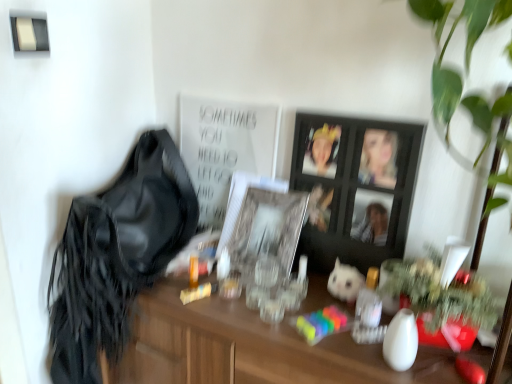
Locate an element on the screen. clear glass picture frame at center, which is counted as the first picture frame, starting from the left is located at coordinates (264, 228).

The height and width of the screenshot is (384, 512). What do you see at coordinates (225, 149) in the screenshot?
I see `white matte poster at upper center` at bounding box center [225, 149].

Where is `white matte poster at upper center`? white matte poster at upper center is located at coordinates (225, 149).

Locate an element on the screen. The width and height of the screenshot is (512, 384). white plush toy at center is located at coordinates (345, 282).

From the image's perspective, which one is positioned higher, black wooden picture frame at center, acting as the 1th picture frame starting from the right, or white plush toy at center?

black wooden picture frame at center, acting as the 1th picture frame starting from the right.

Is white plush toy at center located within black wooden picture frame at center, acting as the 1th picture frame starting from the right?

No, white plush toy at center is not inside black wooden picture frame at center, acting as the 1th picture frame starting from the right.

Is black wooden picture frame at center, arranged as the second picture frame when viewed from the left, aimed at white plush toy at center?

Yes, black wooden picture frame at center, arranged as the second picture frame when viewed from the left, is facing white plush toy at center.

Which object is positioned more to the left, black wooden picture frame at center, acting as the 1th picture frame starting from the right, or white plush toy at center?

black wooden picture frame at center, acting as the 1th picture frame starting from the right.

Does satin black shoulder bag at left have a lesser width compared to white plush toy at center?

In fact, satin black shoulder bag at left might be wider than white plush toy at center.

From the image's perspective, is satin black shoulder bag at left below white plush toy at center?

No, from the image's perspective, satin black shoulder bag at left is not beneath white plush toy at center.

Would you say satin black shoulder bag at left contains white plush toy at center?

No, satin black shoulder bag at left does not contain white plush toy at center.

Is satin black shoulder bag at left further to the viewer compared to white plush toy at center?

No.

From the image's perspective, between white plush toy at center and black wooden picture frame at center, arranged as the second picture frame when viewed from the left, who is located below?

white plush toy at center.

Which is behind, white plush toy at center or black wooden picture frame at center, arranged as the second picture frame when viewed from the left?

Positioned behind is white plush toy at center.

Locate an element on the screen. animal below the black wooden picture frame at center, acting as the 1th picture frame starting from the right (from a real-world perspective) is located at coordinates (345, 282).

How different are the orientations of white plush toy at center and black wooden picture frame at center, acting as the 1th picture frame starting from the right, in degrees?

The facing directions of white plush toy at center and black wooden picture frame at center, acting as the 1th picture frame starting from the right, are 1.4 degrees apart.

Can you confirm if white matte poster at upper center is positioned to the right of black wooden picture frame at center, arranged as the second picture frame when viewed from the left?

No, white matte poster at upper center is not to the right of black wooden picture frame at center, arranged as the second picture frame when viewed from the left.

From a real-world perspective, is white matte poster at upper center physically located above or below black wooden picture frame at center, acting as the 1th picture frame starting from the right?

Clearly, from a real-world perspective, white matte poster at upper center is above black wooden picture frame at center, acting as the 1th picture frame starting from the right.

Image resolution: width=512 pixels, height=384 pixels. In order to click on picture frame that is the 1st object located below the white matte poster at upper center (from the image's perspective) in this screenshot , I will do `click(355, 187)`.

Is point (206, 118) closer to viewer compared to point (332, 116)?

That is False.

Is satin black shoulder bag at left surrounding white matte poster at upper center?

No.

Is satin black shoulder bag at left wider or thinner than white matte poster at upper center?

satin black shoulder bag at left is wider than white matte poster at upper center.

Considering the positions of objects satin black shoulder bag at left and white matte poster at upper center in the image provided, who is more to the left, satin black shoulder bag at left or white matte poster at upper center?

Positioned to the left is satin black shoulder bag at left.

Considering the relative sizes of satin black shoulder bag at left and white matte poster at upper center in the image provided, is satin black shoulder bag at left smaller than white matte poster at upper center?

No, satin black shoulder bag at left is not smaller than white matte poster at upper center.

Is white matte poster at upper center inside the boundaries of white plush toy at center, or outside?

white matte poster at upper center cannot be found inside white plush toy at center.

From a real-world perspective, is white matte poster at upper center under white plush toy at center?

No.

Considering the sizes of objects white matte poster at upper center and white plush toy at center in the image provided, who is bigger, white matte poster at upper center or white plush toy at center?

white matte poster at upper center is bigger.

Does white matte poster at upper center have a greater height compared to white plush toy at center?

Yes.

Is black wooden picture frame at center, arranged as the second picture frame when viewed from the left, thinner than satin black shoulder bag at left?

Correct, the width of black wooden picture frame at center, arranged as the second picture frame when viewed from the left, is less than that of satin black shoulder bag at left.

This screenshot has height=384, width=512. Find the location of `the 1st picture frame behind the satin black shoulder bag at left`. the 1st picture frame behind the satin black shoulder bag at left is located at coordinates (355, 187).

Is black wooden picture frame at center, acting as the 1th picture frame starting from the right, placed right next to satin black shoulder bag at left?

No, black wooden picture frame at center, acting as the 1th picture frame starting from the right, is not in contact with satin black shoulder bag at left.

Is black wooden picture frame at center, acting as the 1th picture frame starting from the right, oriented towards satin black shoulder bag at left?

No, black wooden picture frame at center, acting as the 1th picture frame starting from the right, does not turn towards satin black shoulder bag at left.

You are a GUI agent. You are given a task and a screenshot of the screen. Output one action in this format:
    pyautogui.click(x=<x>, y=<y>)
    Task: Click on the animal located behind the black wooden picture frame at center, arranged as the second picture frame when viewed from the left
    
    Given the screenshot: What is the action you would take?
    pyautogui.click(x=345, y=282)

Locate an element on the screen. This screenshot has height=384, width=512. shoulder bag in front of the white plush toy at center is located at coordinates (117, 255).

Based on their spatial positions, is white matte poster at upper center or white plush toy at center further from black wooden picture frame at center, acting as the 1th picture frame starting from the right?

white matte poster at upper center.

Considering their positions, is clear glass picture frame at center, which is counted as the first picture frame, starting from the left, positioned closer to satin black shoulder bag at left than white plush toy at center?

The object closer to satin black shoulder bag at left is clear glass picture frame at center, which is counted as the first picture frame, starting from the left.

Based on their spatial positions, is white plush toy at center or satin black shoulder bag at left closer to black wooden picture frame at center, arranged as the second picture frame when viewed from the left?

white plush toy at center is closer to black wooden picture frame at center, arranged as the second picture frame when viewed from the left.

Considering their positions, is clear glass picture frame at center, which is counted as the first picture frame, starting from the left, positioned closer to black wooden picture frame at center, arranged as the second picture frame when viewed from the left, than satin black shoulder bag at left?

Among the two, clear glass picture frame at center, which is counted as the first picture frame, starting from the left, is located nearer to black wooden picture frame at center, arranged as the second picture frame when viewed from the left.

Considering their positions, is clear glass picture frame at center, which is counted as the first picture frame, starting from the left, positioned closer to white plush toy at center than white matte poster at upper center?

clear glass picture frame at center, which is counted as the first picture frame, starting from the left, lies closer to white plush toy at center than the other object.

When comparing their distances from satin black shoulder bag at left, does black wooden picture frame at center, arranged as the second picture frame when viewed from the left, or clear glass picture frame at center, acting as the 2th picture frame starting from the right, seem further?

Among the two, black wooden picture frame at center, arranged as the second picture frame when viewed from the left, is located further to satin black shoulder bag at left.

Based on their spatial positions, is white plush toy at center or black wooden picture frame at center, arranged as the second picture frame when viewed from the left, further from satin black shoulder bag at left?

white plush toy at center.

Estimate the real-world distances between objects in this image. Which object is further from satin black shoulder bag at left, clear glass picture frame at center, which is counted as the first picture frame, starting from the left, or white matte poster at upper center?

clear glass picture frame at center, which is counted as the first picture frame, starting from the left, lies further to satin black shoulder bag at left than the other object.

The height and width of the screenshot is (384, 512). Identify the location of bulletin board located between satin black shoulder bag at left and black wooden picture frame at center, acting as the 1th picture frame starting from the right, in the left-right direction. (225, 149).

I want to click on bulletin board situated between satin black shoulder bag at left and white plush toy at center from left to right, so [x=225, y=149].

The height and width of the screenshot is (384, 512). What are the coordinates of `picture frame between white matte poster at upper center and black wooden picture frame at center, arranged as the second picture frame when viewed from the left, in the horizontal direction` in the screenshot? It's located at (264, 228).

Identify the location of picture frame between satin black shoulder bag at left and black wooden picture frame at center, arranged as the second picture frame when viewed from the left, in the horizontal direction. (264, 228).